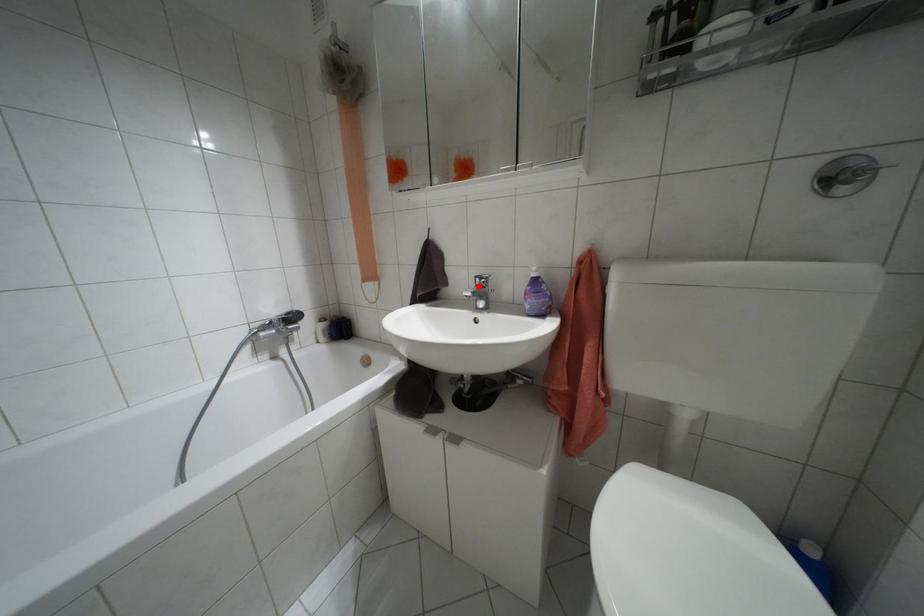
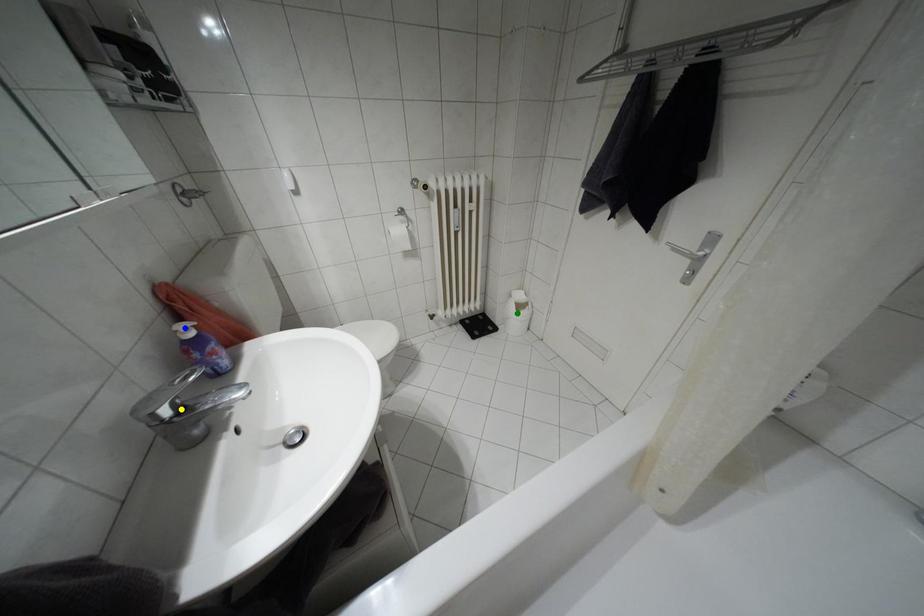
Question: I am providing you with two images of the same scene from different viewpoints. A red point is marked on the first image. You are given multiple points on the second image. Which point in image 2 is actually the same real-world point as the red point in image 1?

Choices:
 (A) green point
 (B) yellow point
 (C) blue point

Answer: (B)